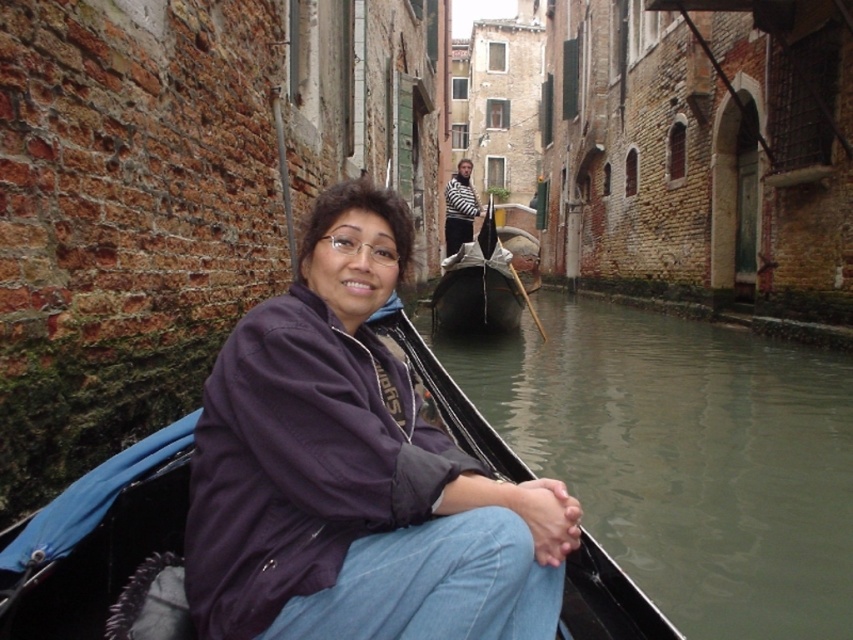
You are standing on the dock and see the purple fabric jacket at center and the greenish water at lower left. Which object is closer to your left side?

The purple fabric jacket at center is to the left of the greenish water at lower left, so the purple fabric jacket at center is closer to your left side.

You are a tourist in Venice and want to take a photo of the black polished wood gondola at center and the greenish water at lower left. Which object appears taller in the photo?

The black polished wood gondola at center appears taller than the greenish water at lower left in the photo.